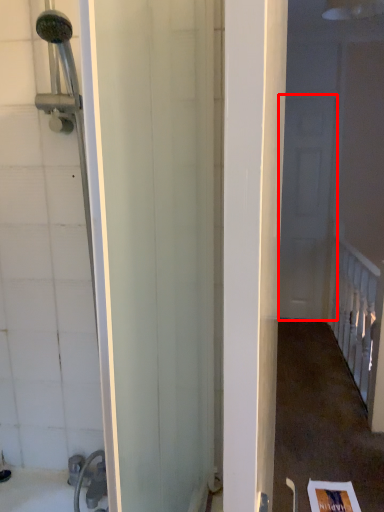
Question: From the image's perspective, what is the correct spatial relationship of screen door (annotated by the red box) in relation to rail?

Choices:
 (A) below
 (B) above

Answer: (B)